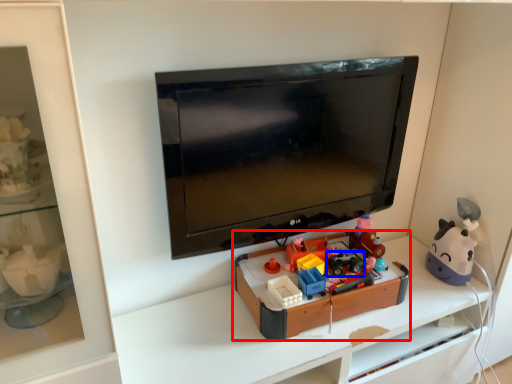
Question: Which object is further to the camera taking this photo, toy (highlighted by a red box) or toy (highlighted by a blue box)?

Choices:
 (A) toy
 (B) toy

Answer: (B)